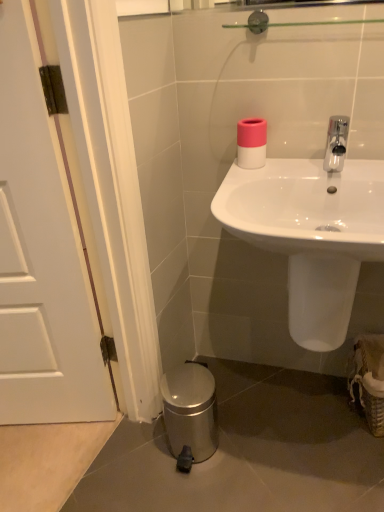
Image resolution: width=384 pixels, height=512 pixels. In order to click on white matte door at left in this screenshot , I will do `click(41, 256)`.

I want to click on woven straw basket at lower right, so click(x=368, y=379).

You are a GUI agent. You are given a task and a screenshot of the screen. Output one action in this format:
    pyautogui.click(x=<x>, y=<y>)
    Task: Click on the white glossy sink at center
    Image resolution: width=384 pixels, height=512 pixels.
    Given the screenshot: What is the action you would take?
    pyautogui.click(x=310, y=234)

Is pink matte toilet paper at upper center bigger or smaller than white matte door at left?

Considering their sizes, pink matte toilet paper at upper center takes up less space than white matte door at left.

Between pink matte toilet paper at upper center and white matte door at left, which one appears on the left side from the viewer's perspective?

white matte door at left is more to the left.

Considering the sizes of objects pink matte toilet paper at upper center and white matte door at left in the image provided, who is shorter, pink matte toilet paper at upper center or white matte door at left?

pink matte toilet paper at upper center is shorter.

The height and width of the screenshot is (512, 384). What are the coordinates of `sink to the right of white matte door at left` in the screenshot? It's located at (310, 234).

How many degrees apart are the facing directions of white glossy sink at center and white matte door at left?

There is a 81.7-degree angle between the facing directions of white glossy sink at center and white matte door at left.

From a real-world perspective, is white glossy sink at center positioned over white matte door at left based on gravity?

No, from a real-world perspective, white glossy sink at center is not above white matte door at left.

Considering the positions of objects white glossy sink at center and white matte door at left in the image provided, who is more to the left, white glossy sink at center or white matte door at left?

From the viewer's perspective, white matte door at left appears more on the left side.

At what (x,y) coordinates should I click in order to perform the action: click on basket below the white glossy sink at center (from a real-world perspective). Please return your answer as a coordinate pair (x, y). The height and width of the screenshot is (512, 384). Looking at the image, I should click on (368, 379).

Is woven straw basket at lower right oriented towards white glossy sink at center?

No, woven straw basket at lower right is not turned towards white glossy sink at center.

Between woven straw basket at lower right and white glossy sink at center, which one is positioned behind?

woven straw basket at lower right is more distant.

Considering the sizes of woven straw basket at lower right and white glossy sink at center in the image, is woven straw basket at lower right bigger or smaller than white glossy sink at center?

Considering their sizes, woven straw basket at lower right takes up less space than white glossy sink at center.

The height and width of the screenshot is (512, 384). Find the location of `basket below the polished chrome faucet at upper right (from the image's perspective)`. basket below the polished chrome faucet at upper right (from the image's perspective) is located at coordinates tap(368, 379).

Who is shorter, woven straw basket at lower right or polished chrome faucet at upper right?

polished chrome faucet at upper right is shorter.

From the image's perspective, between woven straw basket at lower right and polished chrome faucet at upper right, who is located below?

From the image's view, woven straw basket at lower right is below.

What's the angular difference between white glossy sink at center and woven straw basket at lower right's facing directions?

The angular difference between white glossy sink at center and woven straw basket at lower right is 9.22 degrees.

Is the surface of white glossy sink at center in direct contact with woven straw basket at lower right?

No, white glossy sink at center is not making contact with woven straw basket at lower right.

From a real-world perspective, who is located higher, white glossy sink at center or woven straw basket at lower right?

white glossy sink at center is physically above.

Is white glossy sink at center facing away from woven straw basket at lower right?

No, white glossy sink at center's orientation is not away from woven straw basket at lower right.

From the image's perspective, is white matte door at left located above woven straw basket at lower right?

Yes, from the image's perspective, white matte door at left is above woven straw basket at lower right.

Who is bigger, white matte door at left or woven straw basket at lower right?

white matte door at left.

Between white matte door at left and woven straw basket at lower right, which one has less height?

Standing shorter between the two is woven straw basket at lower right.

Which is more to the right, white matte door at left or woven straw basket at lower right?

woven straw basket at lower right.

Which is more to the right, white matte door at left or white glossy sink at center?

From the viewer's perspective, white glossy sink at center appears more on the right side.

Is white matte door at left further to camera compared to white glossy sink at center?

That is False.

Who is taller, white matte door at left or white glossy sink at center?

With more height is white matte door at left.

Identify the location of door that appears below the pink matte toilet paper at upper center (from the image's perspective). (41, 256).

Where is `sink above the white matte door at left (from the image's perspective)`? Image resolution: width=384 pixels, height=512 pixels. sink above the white matte door at left (from the image's perspective) is located at coordinates (310, 234).

Which object lies further to the anchor point polished chrome faucet at upper right, white matte door at left or white glossy sink at center?

white matte door at left is positioned further to the anchor polished chrome faucet at upper right.

From the image, which object appears to be nearer to woven straw basket at lower right, polished chrome faucet at upper right or white matte door at left?

polished chrome faucet at upper right.

From the image, which object appears to be nearer to polished chrome faucet at upper right, woven straw basket at lower right or white glossy sink at center?

Based on the image, white glossy sink at center appears to be nearer to polished chrome faucet at upper right.

Considering their positions, is pink matte toilet paper at upper center positioned closer to white glossy sink at center than white matte door at left?

pink matte toilet paper at upper center.

From the image, which object appears to be farther from white matte door at left, polished chrome faucet at upper right or white glossy sink at center?

polished chrome faucet at upper right is positioned further to the anchor white matte door at left.

Considering their positions, is white glossy sink at center positioned closer to pink matte toilet paper at upper center than polished chrome faucet at upper right?

polished chrome faucet at upper right is closer to pink matte toilet paper at upper center.

When comparing their distances from white glossy sink at center, does polished chrome faucet at upper right or woven straw basket at lower right seem further?

Based on the image, woven straw basket at lower right appears to be further to white glossy sink at center.

Which object lies further to the anchor point polished chrome faucet at upper right, white glossy sink at center or woven straw basket at lower right?

woven straw basket at lower right lies further to polished chrome faucet at upper right than the other object.

Where is `sink between pink matte toilet paper at upper center and woven straw basket at lower right from top to bottom`? The width and height of the screenshot is (384, 512). sink between pink matte toilet paper at upper center and woven straw basket at lower right from top to bottom is located at coordinates (310, 234).

Find the location of a particular element. The image size is (384, 512). tap located between white matte door at left and woven straw basket at lower right in the left-right direction is located at coordinates (336, 143).

Where is `sink between white matte door at left and polished chrome faucet at upper right`? sink between white matte door at left and polished chrome faucet at upper right is located at coordinates (310, 234).

At what (x,y) coordinates should I click in order to perform the action: click on sink located between white matte door at left and pink matte toilet paper at upper center in the depth direction. Please return your answer as a coordinate pair (x, y). Looking at the image, I should click on (310, 234).